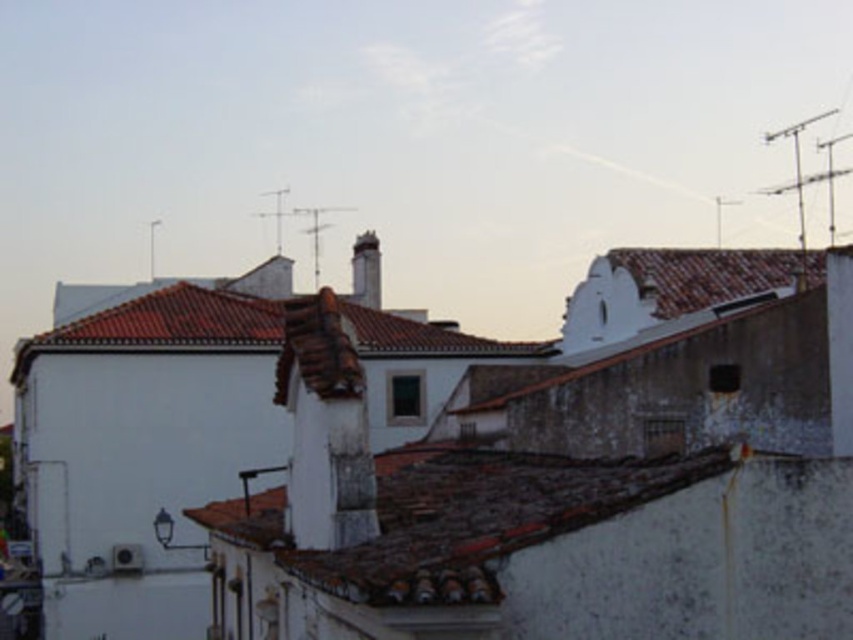
Which is below, brown tile roof at center or white stone chimney at center?

brown tile roof at center

This screenshot has width=853, height=640. What do you see at coordinates (450, 518) in the screenshot? I see `brown tile roof at center` at bounding box center [450, 518].

Where is `brown tile roof at center`? brown tile roof at center is located at coordinates (450, 518).